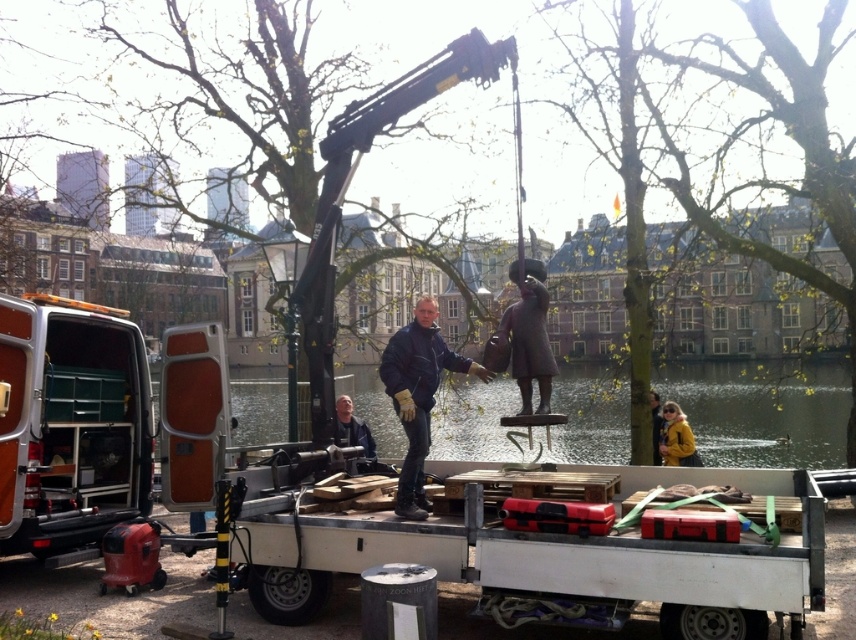
Between white wooden trailer truck at center and green water at center, which one appears on the right side from the viewer's perspective?

Positioned to the right is green water at center.

Which is in front, point (290, 593) or point (242, 429)?

Positioned in front is point (290, 593).

Find the location of a particular element. The height and width of the screenshot is (640, 856). white wooden trailer truck at center is located at coordinates (539, 554).

Consider the image. Does blue matte jacket at center appear over bronze statue at center?

No, blue matte jacket at center is not above bronze statue at center.

Does blue matte jacket at center appear under bronze statue at center?

Yes, blue matte jacket at center is below bronze statue at center.

What do you see at coordinates (418, 394) in the screenshot?
I see `blue matte jacket at center` at bounding box center [418, 394].

Identify the location of blue matte jacket at center. This screenshot has height=640, width=856. (418, 394).

Can you confirm if white wooden trailer truck at center is wider than yellow matte jacket at lower right?

Indeed, white wooden trailer truck at center has a greater width compared to yellow matte jacket at lower right.

Which is below, white wooden trailer truck at center or yellow matte jacket at lower right?

Positioned lower is white wooden trailer truck at center.

Is point (263, 582) positioned before point (670, 410)?

Yes, it is.

Locate an element on the screen. The height and width of the screenshot is (640, 856). white wooden trailer truck at center is located at coordinates (539, 554).